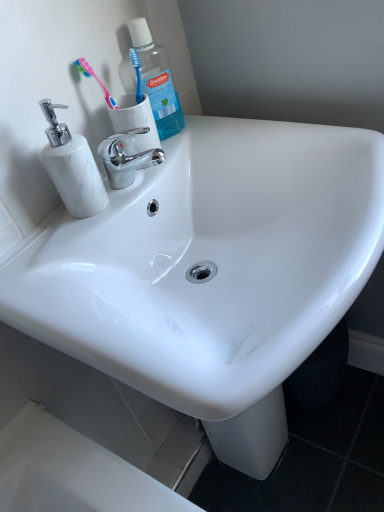
The width and height of the screenshot is (384, 512). What are the coordinates of `vacant space to the right of white marble soap dispenser at left` in the screenshot? It's located at (142, 181).